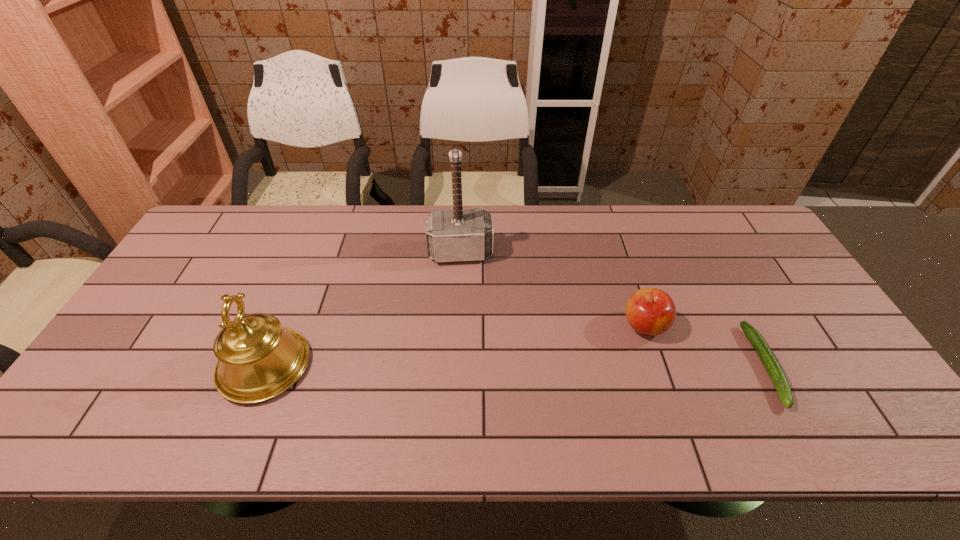
Locate an element on the screen. This screenshot has width=960, height=540. unoccupied area between the third object from right to left and the bell is located at coordinates (363, 309).

This screenshot has width=960, height=540. I want to click on free point between the farthest object and the rightmost object, so click(x=612, y=309).

Find the location of `vacant space in between the bell and the farthest object`. vacant space in between the bell and the farthest object is located at coordinates point(363,309).

I want to click on empty space that is in between the leftmost object and the farthest object, so click(363, 309).

This screenshot has width=960, height=540. Find the location of `object that is the third closest one to the leftmost object`. object that is the third closest one to the leftmost object is located at coordinates (766, 355).

Identify which object is the closest to the second shortest object. Please provide its 2D coordinates. Your answer should be formatted as a tuple, i.e. [(x, y)], where the tuple contains the x and y coordinates of a point satisfying the conditions above.

[(766, 355)]